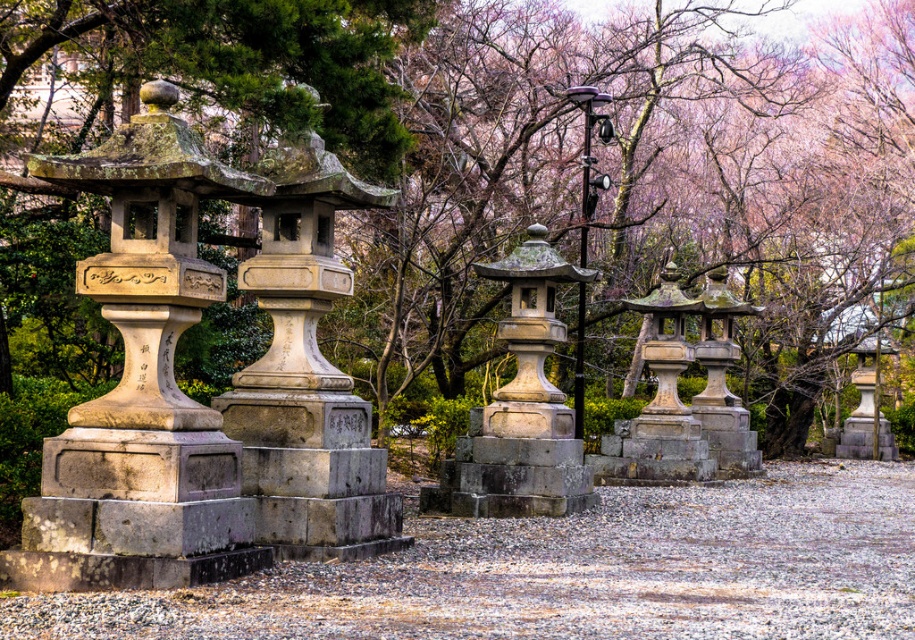
Question: Which object appears farthest from the camera in this image?

Choices:
 (A) polished metal lamp post at center
 (B) gray gravel at center
 (C) green textured stone lantern at center

Answer: (A)

Question: Which of the following is the farthest from the observer?

Choices:
 (A) polished metal lamp post at center
 (B) gray gravel at center

Answer: (A)

Question: Does green textured stone lantern at center have a larger size compared to polished metal lamp post at center?

Choices:
 (A) yes
 (B) no

Answer: (A)

Question: Does green textured stone lantern at center have a lesser width compared to polished metal lamp post at center?

Choices:
 (A) no
 (B) yes

Answer: (A)

Question: Which is farther from the green textured stone lantern at center?

Choices:
 (A) gray gravel at center
 (B) polished metal lamp post at center

Answer: (B)

Question: Can you confirm if green textured stone lantern at center is positioned to the right of polished metal lamp post at center?

Choices:
 (A) no
 (B) yes

Answer: (A)